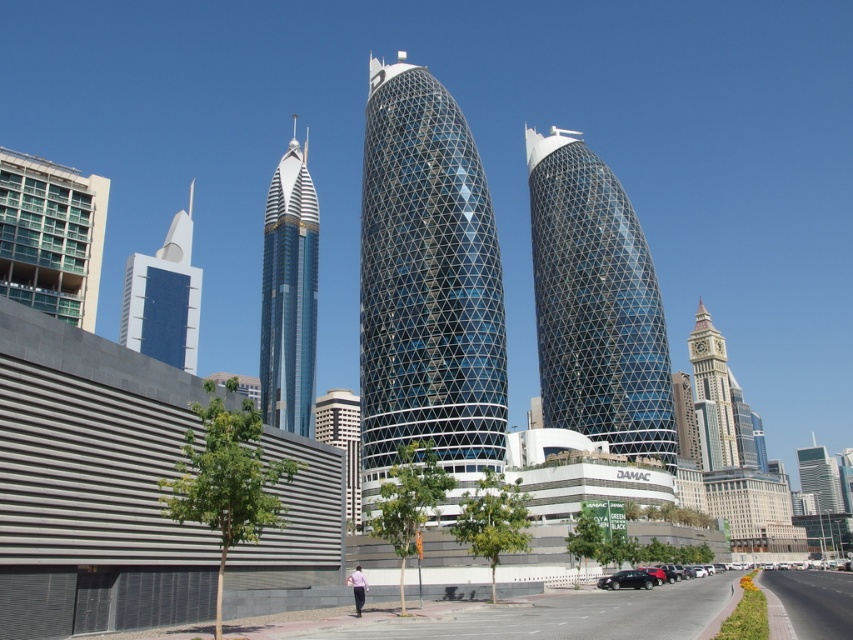
Based on the provided scene description, where is the green glass building at upper left located in the image?

The green glass building at upper left is located at point (50, 236) in the image.

You are a drone operator tasked with capturing aerial footage of the DAMAC complex. Your drone has a limited battery life and can only hover at a specific point. If you position your drone at point (341, 442), what structure will it be directly above?

The white textured building at center is located at point (341, 442), so positioning the drone there will place it directly above the white textured building at center.

You are standing at the pedestrian walkway in the urban scene. You notice two points marked in the image. Which point, point (155, 342) or point (805, 481), is closer to you?

Point (155, 342) is closer to the viewer than point (805, 481).